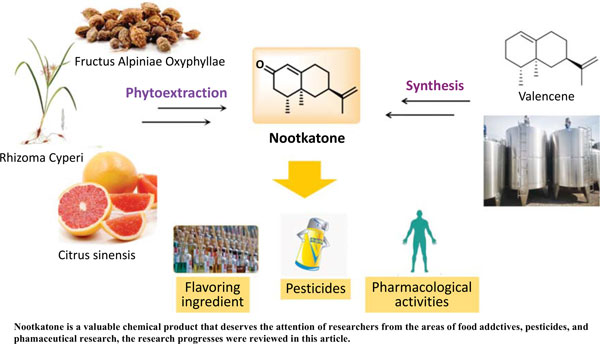
The height and width of the screenshot is (344, 600). Identify the location of chest. (420, 225).